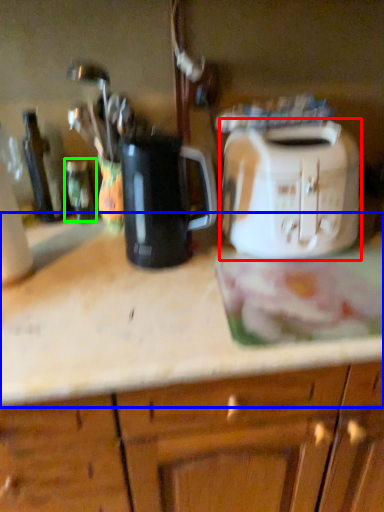
Question: Which object is positioned closest to toaster (highlighted by a red box)? Select from countertop (highlighted by a blue box) and bottle (highlighted by a green box).

Choices:
 (A) countertop
 (B) bottle

Answer: (A)